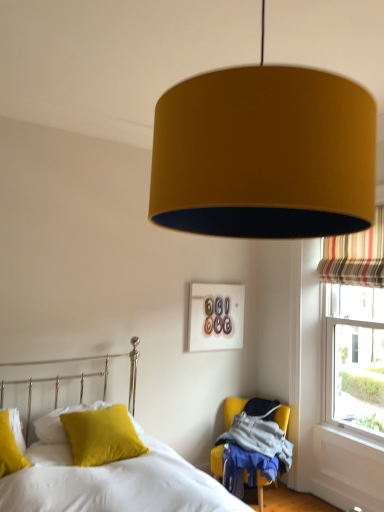
Question: Is mustard fabric chair at lower right wider or thinner than soft yellow pillow at lower left?

Choices:
 (A) wide
 (B) thin

Answer: (B)

Question: In terms of height, does mustard fabric chair at lower right look taller or shorter compared to soft yellow pillow at lower left?

Choices:
 (A) tall
 (B) short

Answer: (B)

Question: Which is nearer to the mustard fabric chair at lower right?

Choices:
 (A) velvet yellow pillow at lower left, which is the first pillow from front to back
 (B) velvet yellow pillow at lower left, the 1th pillow viewed from the back
 (C) matte yellow pillow at lower left, the second pillow when ordered from back to front
 (D) striped fabric curtain at right
 (E) mustard fabric lampshade at upper center

Answer: (B)

Question: Estimate the real-world distances between objects in this image. Which object is farther from the velvet yellow pillow at lower left, which ranks as the third pillow in back-to-front order?

Choices:
 (A) matte yellow pillow at lower left, the second pillow when ordered from back to front
 (B) soft yellow pillow at lower left
 (C) striped fabric curtain at right
 (D) velvet yellow pillow at lower left, which is the 3th pillow from front to back
 (E) mustard fabric chair at lower right

Answer: (C)